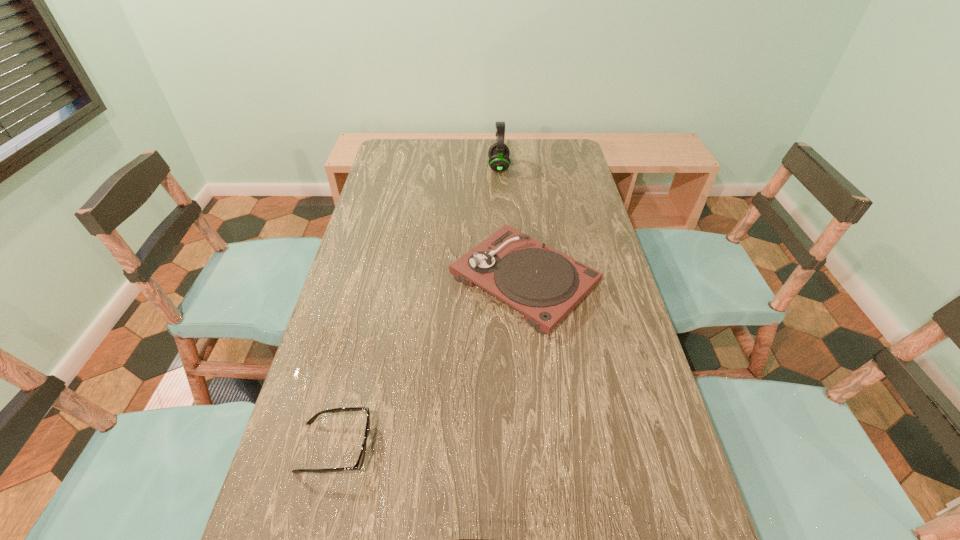
Locate an element on the screen. The height and width of the screenshot is (540, 960). free point that satisfies the following two spatial constraints: 1. on the ear cups of the second farthest object; 2. on the left side of the farthest object is located at coordinates coord(506,280).